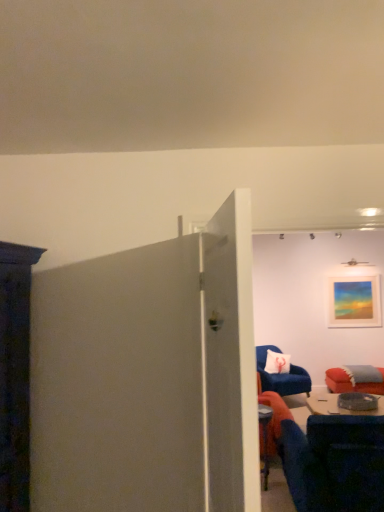
Question: Does white glossy door at center have a smaller size compared to velvet blue chair at right, which is the second chair in front-to-back order?

Choices:
 (A) no
 (B) yes

Answer: (B)

Question: Is there a large distance between white glossy door at center and velvet blue chair at right, which is the second chair in front-to-back order?

Choices:
 (A) yes
 (B) no

Answer: (A)

Question: Considering the relative sizes of white glossy door at center and velvet blue chair at right, arranged as the 1th chair when viewed from the back, in the image provided, is white glossy door at center bigger than velvet blue chair at right, arranged as the 1th chair when viewed from the back,?

Choices:
 (A) no
 (B) yes

Answer: (A)

Question: Does white glossy door at center have a greater height compared to velvet blue chair at right, arranged as the 1th chair when viewed from the back?

Choices:
 (A) no
 (B) yes

Answer: (B)

Question: Is white glossy door at center positioned behind velvet blue chair at right, arranged as the 1th chair when viewed from the back?

Choices:
 (A) yes
 (B) no

Answer: (B)

Question: From a real-world perspective, is white glossy door at center beneath velvet blue chair at right, arranged as the 1th chair when viewed from the back?

Choices:
 (A) yes
 (B) no

Answer: (B)

Question: Can we say blue fabric chair at lower right, which appears as the 2th chair when viewed from the back, lies outside velvet blue chair at right, which is the second chair in front-to-back order?

Choices:
 (A) yes
 (B) no

Answer: (A)

Question: From the image's perspective, would you say blue fabric chair at lower right, which appears as the 2th chair when viewed from the back, is shown under velvet blue chair at right, arranged as the 1th chair when viewed from the back?

Choices:
 (A) yes
 (B) no

Answer: (B)

Question: Is velvet blue chair at right, which is the second chair in front-to-back order, completely or partially inside blue fabric chair at lower right, which appears as the 2th chair when viewed from the back?

Choices:
 (A) yes
 (B) no

Answer: (B)

Question: Is blue fabric chair at lower right, which appears as the 2th chair when viewed from the back, aimed at velvet blue chair at right, arranged as the 1th chair when viewed from the back?

Choices:
 (A) yes
 (B) no

Answer: (A)

Question: Can you confirm if blue fabric chair at lower right, the first chair viewed from the front, is wider than velvet blue chair at right, arranged as the 1th chair when viewed from the back?

Choices:
 (A) yes
 (B) no

Answer: (A)

Question: From the image's perspective, would you say blue fabric chair at lower right, which appears as the 2th chair when viewed from the back, is positioned over velvet blue chair at right, which is the second chair in front-to-back order?

Choices:
 (A) no
 (B) yes

Answer: (B)

Question: Is blue fabric chair at lower right, the first chair viewed from the front, shorter than matte acrylic painting at upper right?

Choices:
 (A) yes
 (B) no

Answer: (B)